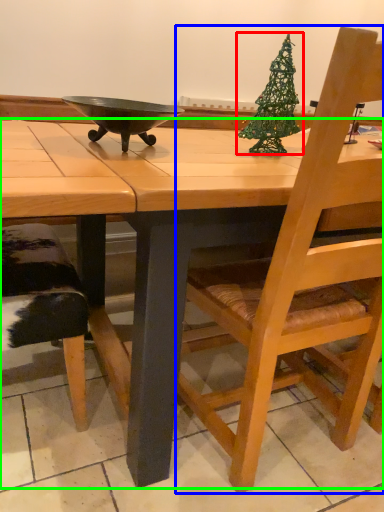
Question: Which object is the farthest from christmas tree (highlighted by a red box)? Choose among these: chair (highlighted by a blue box) or desk (highlighted by a green box).

Choices:
 (A) chair
 (B) desk

Answer: (A)